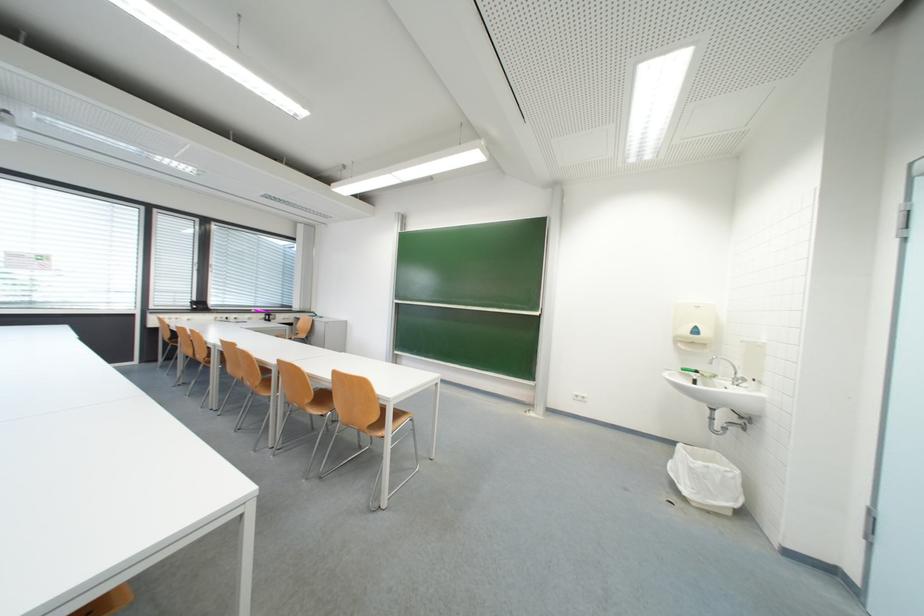
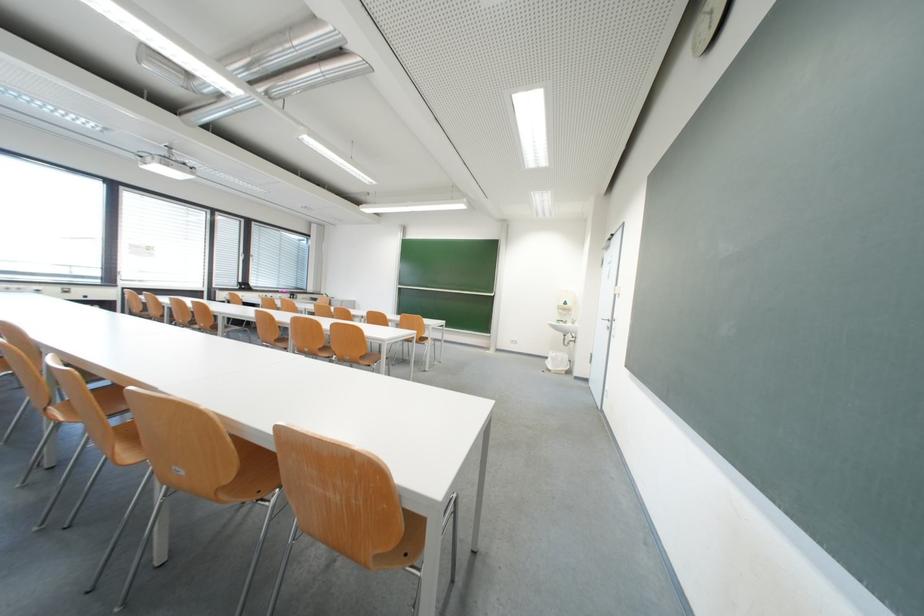
Locate, in the second image, the point that corresponds to (694,501) in the first image.

(558, 371)